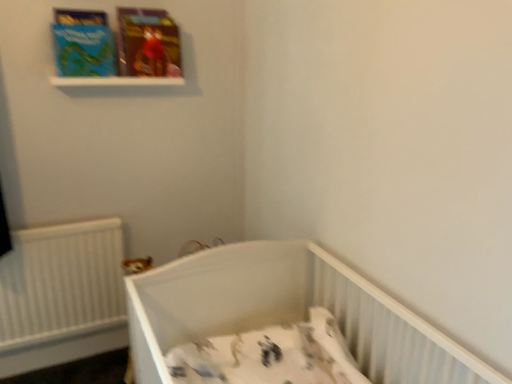
Question: From the image's perspective, is matte cardboard book at upper left, the 2th paperback book when ordered from left to right, on matte blue paperback book at upper left, which is counted as the 1th paperback book, starting from the left?

Choices:
 (A) yes
 (B) no

Answer: (A)

Question: From a real-world perspective, is matte cardboard book at upper left, the 2th paperback book when ordered from left to right, on top of matte blue paperback book at upper left, which is counted as the 1th paperback book, starting from the left?

Choices:
 (A) no
 (B) yes

Answer: (B)

Question: Is matte cardboard book at upper left, which ranks as the first paperback book in right-to-left order, not within matte blue paperback book at upper left, which is counted as the 2th paperback book, starting from the right?

Choices:
 (A) yes
 (B) no

Answer: (A)

Question: From a real-world perspective, is matte cardboard book at upper left, the 2th paperback book when ordered from left to right, beneath matte blue paperback book at upper left, which is counted as the 1th paperback book, starting from the left?

Choices:
 (A) yes
 (B) no

Answer: (B)

Question: Does matte cardboard book at upper left, the 2th paperback book when ordered from left to right, come in front of matte blue paperback book at upper left, which is counted as the 1th paperback book, starting from the left?

Choices:
 (A) no
 (B) yes

Answer: (A)

Question: Is point (162, 269) positioned closer to the camera than point (173, 84)?

Choices:
 (A) closer
 (B) farther

Answer: (A)

Question: From their relative heights in the image, would you say white plastic crib at lower center is taller or shorter than white plastic balustrade at upper center?

Choices:
 (A) tall
 (B) short

Answer: (A)

Question: Do you think white plastic crib at lower center is within white plastic balustrade at upper center, or outside of it?

Choices:
 (A) outside
 (B) inside

Answer: (A)

Question: Based on their positions, is white plastic crib at lower center located to the left or right of white plastic balustrade at upper center?

Choices:
 (A) left
 (B) right

Answer: (B)

Question: Visually, is white plastic balustrade at upper center positioned to the left or to the right of white plastic crib at lower center?

Choices:
 (A) right
 (B) left

Answer: (B)

Question: Considering the positions of white plastic balustrade at upper center and white plastic crib at lower center in the image, is white plastic balustrade at upper center taller or shorter than white plastic crib at lower center?

Choices:
 (A) short
 (B) tall

Answer: (A)

Question: Relative to white plastic crib at lower center, is white plastic balustrade at upper center in front or behind?

Choices:
 (A) front
 (B) behind

Answer: (B)

Question: From the image's perspective, is white plastic balustrade at upper center positioned above or below white plastic crib at lower center?

Choices:
 (A) above
 (B) below

Answer: (A)

Question: Is matte cardboard book at upper left, the 2th paperback book when ordered from left to right, inside the boundaries of matte blue paperback book at upper left, which is counted as the 1th paperback book, starting from the left, or outside?

Choices:
 (A) inside
 (B) outside

Answer: (B)

Question: Considering the positions of matte cardboard book at upper left, which ranks as the first paperback book in right-to-left order, and matte blue paperback book at upper left, which is counted as the 1th paperback book, starting from the left, in the image, is matte cardboard book at upper left, which ranks as the first paperback book in right-to-left order, bigger or smaller than matte blue paperback book at upper left, which is counted as the 1th paperback book, starting from the left,?

Choices:
 (A) big
 (B) small

Answer: (A)